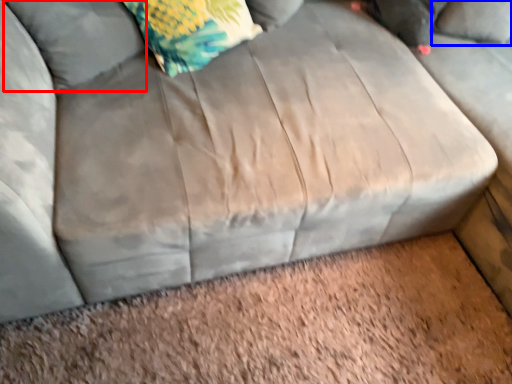
Question: Which object appears farthest to the camera in this image, pillow (highlighted by a red box) or pillow (highlighted by a blue box)?

Choices:
 (A) pillow
 (B) pillow

Answer: (B)